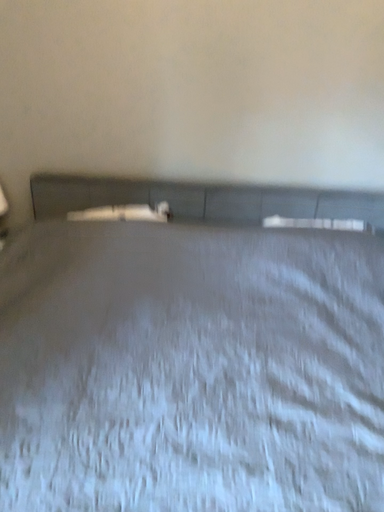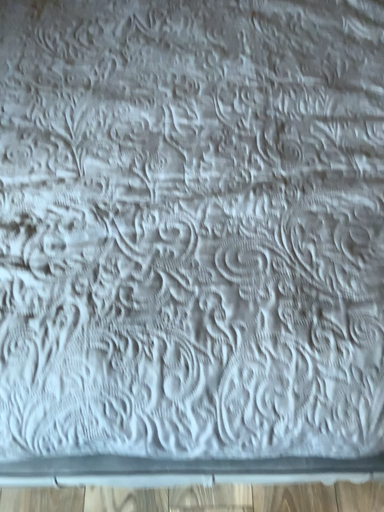
Question: Which way did the camera rotate in the video?

Choices:
 (A) rotated downward
 (B) rotated upward

Answer: (A)